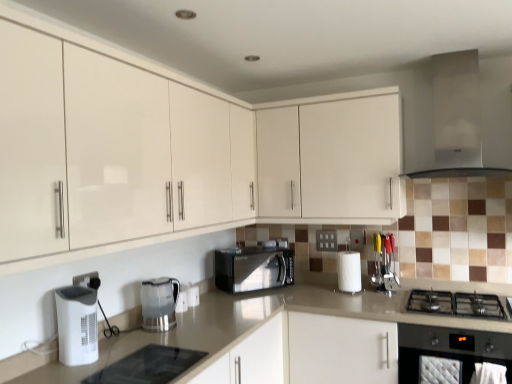
Question: Is white plastic air purifier at lower left, arranged as the first kitchen appliance when viewed from the left, aimed at clear plastic kettle at center, which is counted as the 2th kitchen appliance, starting from the front?

Choices:
 (A) yes
 (B) no

Answer: (B)

Question: From a real-world perspective, is white plastic air purifier at lower left, which appears as the 2th kitchen appliance when viewed from the back, below clear plastic kettle at center, which is counted as the 2th kitchen appliance, starting from the front?

Choices:
 (A) no
 (B) yes

Answer: (A)

Question: Can you confirm if white plastic air purifier at lower left, which appears as the 2th kitchen appliance when viewed from the back, is smaller than clear plastic kettle at center, arranged as the 1th kitchen appliance when viewed from the right?

Choices:
 (A) no
 (B) yes

Answer: (B)

Question: Considering the relative sizes of white plastic air purifier at lower left, the 1th kitchen appliance from the front, and clear plastic kettle at center, arranged as the 1th kitchen appliance when viewed from the right, in the image provided, is white plastic air purifier at lower left, the 1th kitchen appliance from the front, taller than clear plastic kettle at center, arranged as the 1th kitchen appliance when viewed from the right,?

Choices:
 (A) yes
 (B) no

Answer: (A)

Question: Is white plastic air purifier at lower left, arranged as the first kitchen appliance when viewed from the left, facing away from clear plastic kettle at center, the 2th kitchen appliance when ordered from left to right?

Choices:
 (A) no
 (B) yes

Answer: (A)

Question: Is white plastic air purifier at lower left, which is the second kitchen appliance in right-to-left order, bigger than clear plastic kettle at center, which appears as the 1th kitchen appliance when viewed from the back?

Choices:
 (A) no
 (B) yes

Answer: (A)

Question: From a real-world perspective, is white plastic electric outlet at center, the second electric outlet positioned from the front, below white plastic air purifier at lower left, the 1th kitchen appliance from the front?

Choices:
 (A) no
 (B) yes

Answer: (A)

Question: Is there a large distance between white plastic electric outlet at center, the first electric outlet in the back-to-front sequence, and white plastic air purifier at lower left, arranged as the first kitchen appliance when viewed from the left?

Choices:
 (A) no
 (B) yes

Answer: (B)

Question: Does white plastic electric outlet at center, the first electric outlet in the back-to-front sequence, appear on the left side of white plastic air purifier at lower left, the 1th kitchen appliance from the front?

Choices:
 (A) no
 (B) yes

Answer: (A)

Question: Considering the relative positions of white plastic electric outlet at center, the first electric outlet in the back-to-front sequence, and white plastic air purifier at lower left, which is the second kitchen appliance in right-to-left order, in the image provided, is white plastic electric outlet at center, the first electric outlet in the back-to-front sequence, to the right of white plastic air purifier at lower left, which is the second kitchen appliance in right-to-left order, from the viewer's perspective?

Choices:
 (A) yes
 (B) no

Answer: (A)

Question: Can you confirm if white plastic electric outlet at center, which is the first electric outlet from right to left, is smaller than white plastic air purifier at lower left, the 1th kitchen appliance from the front?

Choices:
 (A) no
 (B) yes

Answer: (B)

Question: Can you see white plastic electric outlet at center, which is counted as the 2th electric outlet, starting from the left, touching white plastic air purifier at lower left, which appears as the 2th kitchen appliance when viewed from the back?

Choices:
 (A) yes
 (B) no

Answer: (B)

Question: From a real-world perspective, is white glossy cabinet at upper center, placed as the second cabinetry when sorted from front to back, under clear plastic kettle at center, arranged as the 1th kitchen appliance when viewed from the right?

Choices:
 (A) no
 (B) yes

Answer: (A)